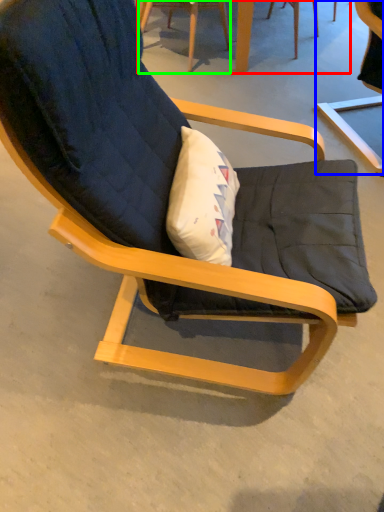
Question: Estimate the real-world distances between objects in this image. Which object is farther from table (highlighted by a red box), chair (highlighted by a blue box) or chair (highlighted by a green box)?

Choices:
 (A) chair
 (B) chair

Answer: (A)